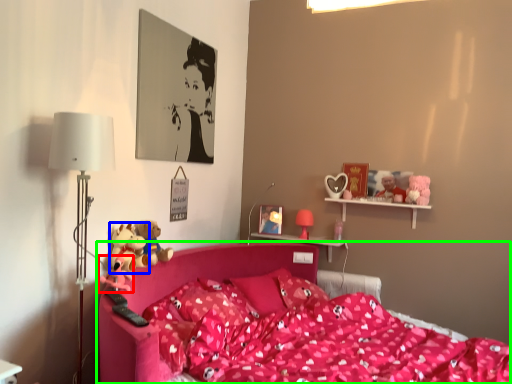
Question: Based on their relative distances, which object is farther from toy (highlighted by a red box)? Choose from toy (highlighted by a blue box) and bed (highlighted by a green box).

Choices:
 (A) toy
 (B) bed

Answer: (B)